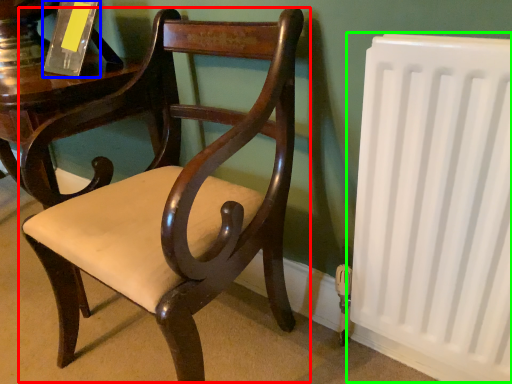
Question: Which is nearer to the chair (highlighted by a red box)? paperback book (highlighted by a blue box) or radiator (highlighted by a green box).

Choices:
 (A) paperback book
 (B) radiator

Answer: (B)